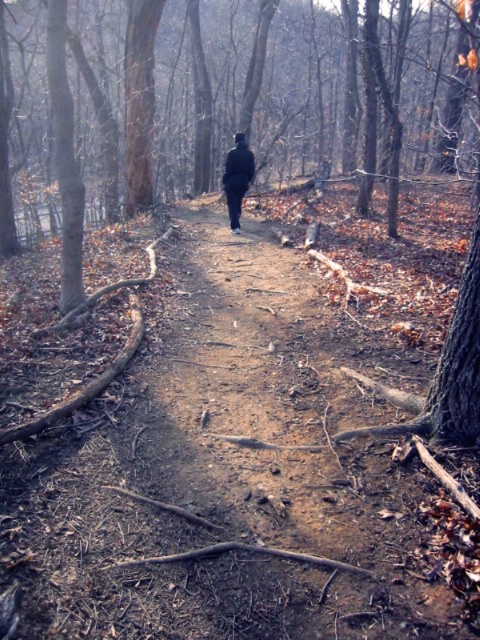
You are a hiker wearing a dark matte coat at center and want to walk along the dirt path at center. Can you walk through the path without any difficulty?

The dirt path at center is wider than the dark matte coat at center, so yes, you can walk through the path without any difficulty.

You are a hiker who has just found a dark matte coat at center on a dirt path at center in a forest. You want to place the coat on the path so it won

The dirt path at center and dark matte coat at center are 19.41 feet apart from each other. Since the coat is already on the path, you don